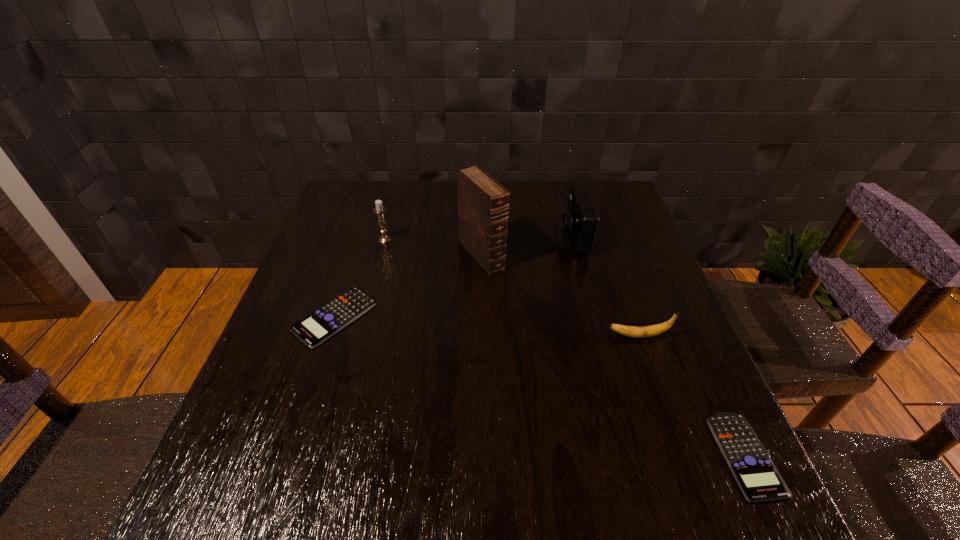
I want to click on object that is at the near edge, so click(759, 480).

Locate an element on the screen. This screenshot has height=540, width=960. object that is at the left edge is located at coordinates (314, 329).

Locate an element on the screen. This screenshot has height=540, width=960. calculator that is at the right edge is located at coordinates (759, 480).

Find the location of a particular element. Image resolution: width=960 pixels, height=540 pixels. camera that is at the right edge is located at coordinates (581, 220).

You are a GUI agent. You are given a task and a screenshot of the screen. Output one action in this format:
    pyautogui.click(x=<x>, y=<y>)
    Task: Click on the banana that is at the right edge
    
    Given the screenshot: What is the action you would take?
    pyautogui.click(x=653, y=330)

This screenshot has width=960, height=540. I want to click on object at the far right corner, so click(581, 220).

Find the location of a particular element. This screenshot has width=960, height=540. object that is positioned at the near right corner is located at coordinates (759, 480).

Identify the location of vacant region at the far edge of the desktop. This screenshot has width=960, height=540. (411, 184).

This screenshot has width=960, height=540. In the image, there is a desktop. Identify the location of blank space at the near edge. (525, 416).

At what (x,y) coordinates should I click in order to perform the action: click on free space at the left edge. Please return your answer as a coordinate pair (x, y). This screenshot has width=960, height=540. Looking at the image, I should click on (340, 258).